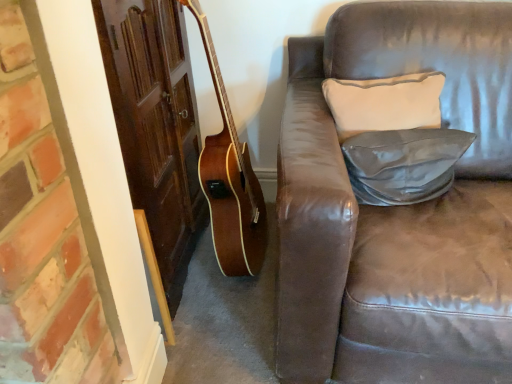
Question: From the image's perspective, is light beige fabric pillow at upper right, arranged as the 2th pillow when ordered from the bottom, above or below leather-like gray pillow at center-right, placed as the first pillow when sorted from bottom to top?

Choices:
 (A) above
 (B) below

Answer: (A)

Question: Considering the positions of light beige fabric pillow at upper right, the 1th pillow positioned from the top, and leather-like gray pillow at center-right, placed as the first pillow when sorted from bottom to top, in the image, is light beige fabric pillow at upper right, the 1th pillow positioned from the top, wider or thinner than leather-like gray pillow at center-right, placed as the first pillow when sorted from bottom to top,?

Choices:
 (A) wide
 (B) thin

Answer: (A)

Question: Considering the relative positions of light beige fabric pillow at upper right, arranged as the 2th pillow when ordered from the bottom, and leather-like gray pillow at center-right, positioned as the 2th pillow in top-to-bottom order, in the image provided, is light beige fabric pillow at upper right, arranged as the 2th pillow when ordered from the bottom, to the left or to the right of leather-like gray pillow at center-right, positioned as the 2th pillow in top-to-bottom order,?

Choices:
 (A) left
 (B) right

Answer: (A)

Question: In the image, is leather-like gray pillow at center-right, positioned as the 2th pillow in top-to-bottom order, positioned in front of or behind light beige fabric pillow at upper right, the 1th pillow positioned from the top?

Choices:
 (A) behind
 (B) front

Answer: (B)

Question: From the image's perspective, is leather-like gray pillow at center-right, positioned as the 2th pillow in top-to-bottom order, above or below light beige fabric pillow at upper right, the 1th pillow positioned from the top?

Choices:
 (A) above
 (B) below

Answer: (B)

Question: Looking at their shapes, would you say leather-like gray pillow at center-right, placed as the first pillow when sorted from bottom to top, is wider or thinner than light beige fabric pillow at upper right, the 1th pillow positioned from the top?

Choices:
 (A) thin
 (B) wide

Answer: (A)

Question: Is leather-like gray pillow at center-right, positioned as the 2th pillow in top-to-bottom order, bigger or smaller than light beige fabric pillow at upper right, arranged as the 2th pillow when ordered from the bottom?

Choices:
 (A) small
 (B) big

Answer: (A)